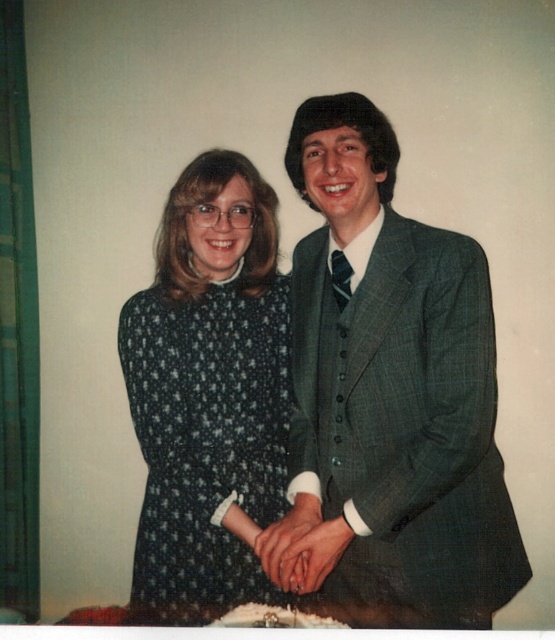
You are a photographer adjusting the lighting for a portrait. You notice the green textured suit at center and the smooth skin hands at center. Which object is closer to the camera lens?

The green textured suit at center is positioned over smooth skin hands at center, so the green textured suit at center is closer to the camera lens.

From the picture: You are a photographer setting up for a portrait. You notice the dark blue dotted fabric dress at center and the matte black hand at center. Which object is positioned higher in the image?

The dark blue dotted fabric dress at center is above the matte black hand at center, so the dress is higher.

You are a photographer standing 1.6 meters away from the dark blue dotted fabric dress at center. Can you reach out and touch the dress without moving your feet?

The dark blue dotted fabric dress at center is 1.58 meters away from the viewer. Since you are standing 1.6 meters away, you cannot reach it without moving because the distance is slightly farther than your arm length.